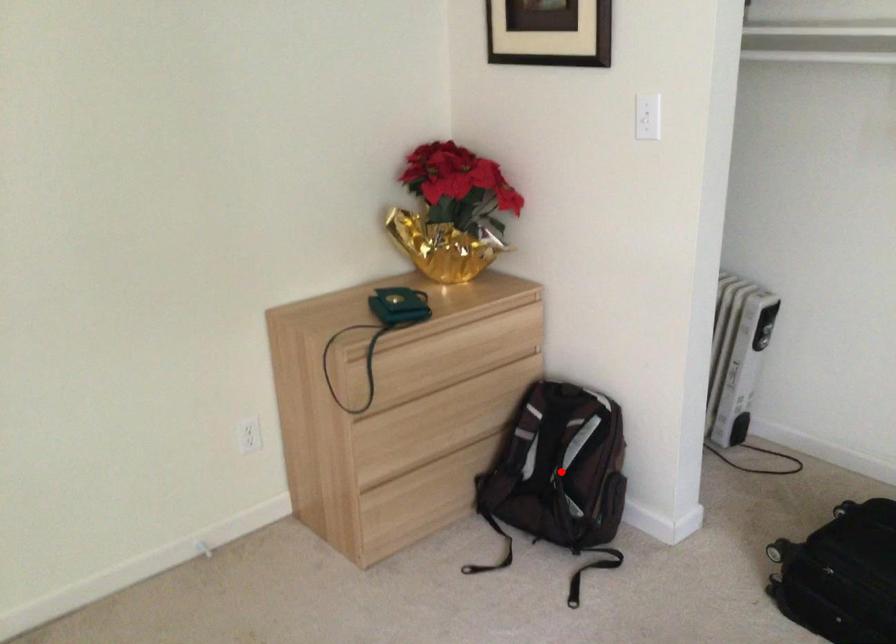
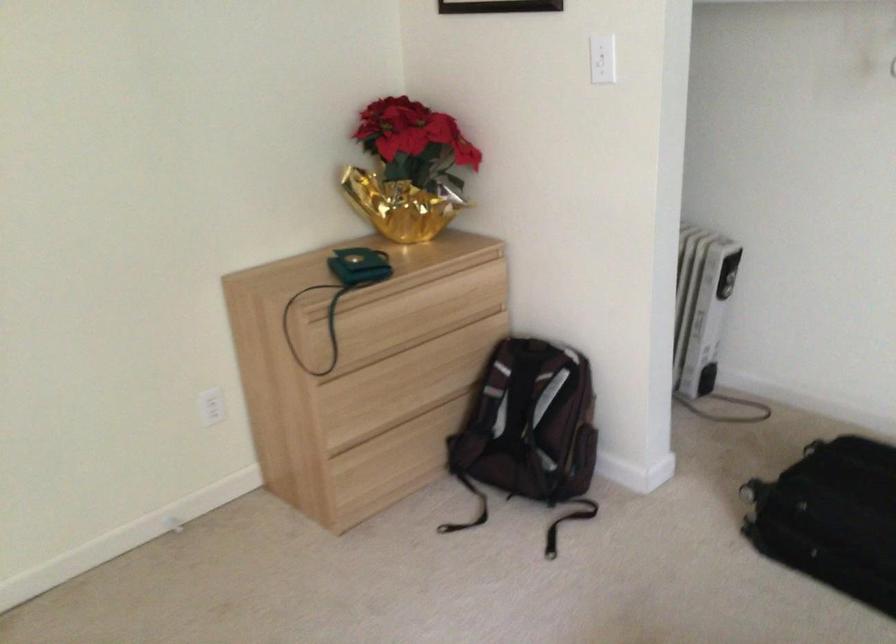
Where in the second image is the point corresponding to the highlighted location from the first image?

(531, 427)